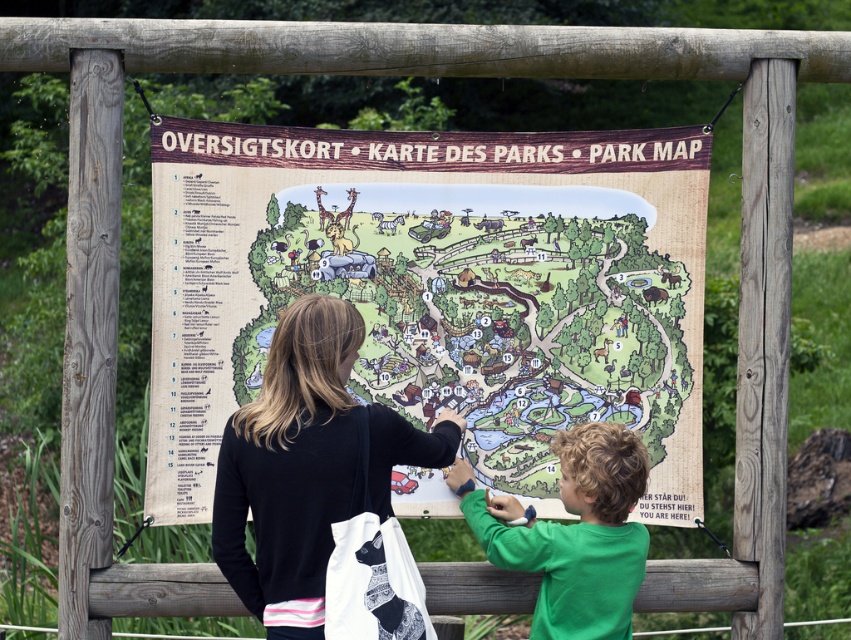
You are a visitor holding a black fabric bag at center and want to place it near a green matte shirt at lower right. Given that the distance between them is 24.91 inches, can you estimate if you can comfortably reach to place the bag without moving your feet?

The black fabric bag at center is 24.91 inches away from the green matte shirt at lower right. Since the average comfortable reaching distance for most adults is around 24 to 30 inches, you can comfortably reach to place the bag without moving your feet.